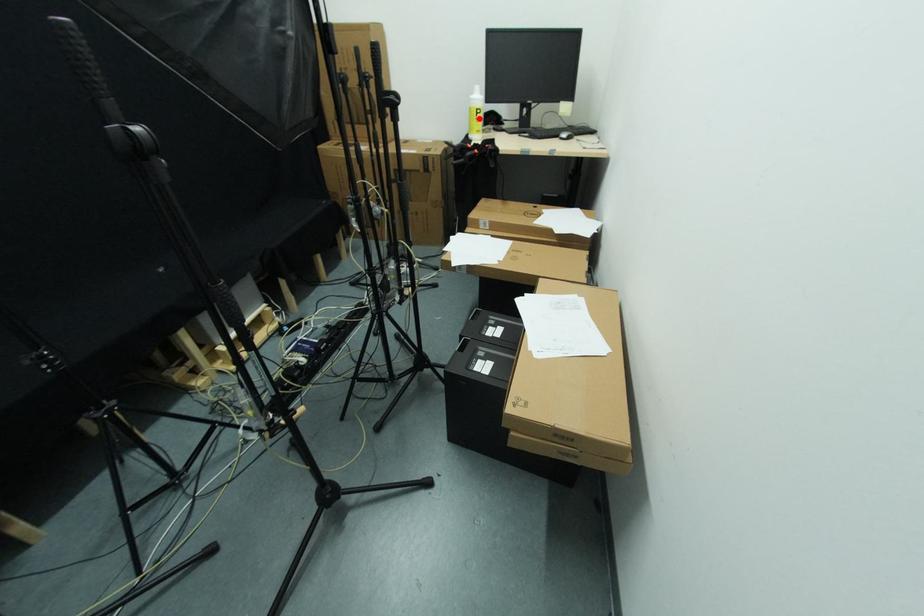
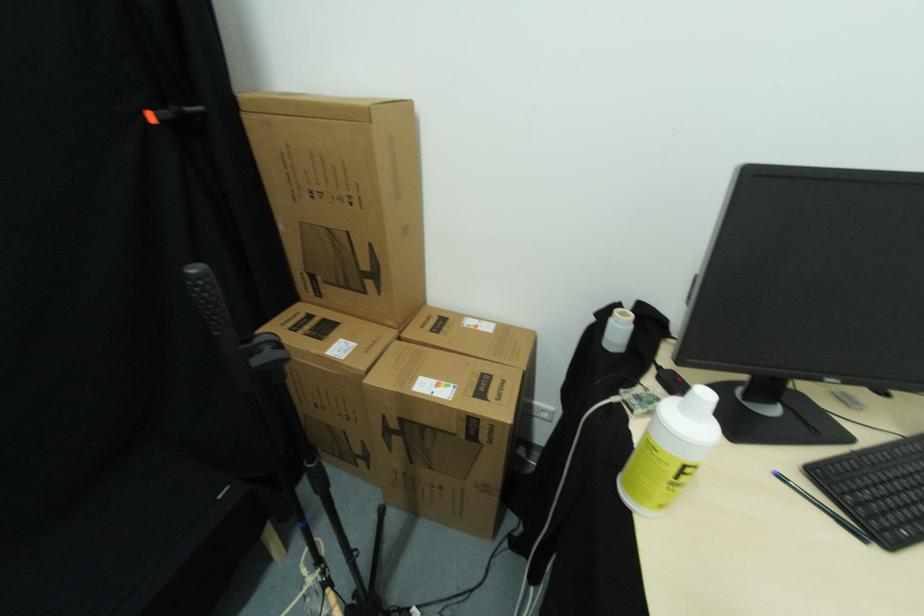
Question: I am providing you with two images of the same scene from different viewpoints. A red point is shown in image1. For the corresponding object point in image2, is it positioned nearer or farther from the camera?

Choices:
 (A) Nearer
 (B) Farther

Answer: (B)